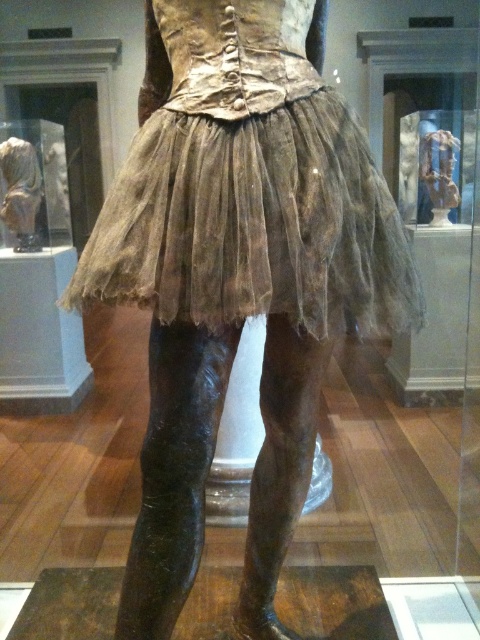
Question: Which point is farther from the camera taking this photo?

Choices:
 (A) (144, 232)
 (B) (24, 244)
 (C) (454, 186)

Answer: (B)

Question: Considering the relative positions of brown sheer tulle skirt at center and matte bronze statue at upper right in the image provided, where is brown sheer tulle skirt at center located with respect to matte bronze statue at upper right?

Choices:
 (A) above
 (B) below

Answer: (B)

Question: Which point is farther from the camera taking this photo?

Choices:
 (A) (435, 189)
 (B) (224, 216)
 (C) (33, 193)

Answer: (A)

Question: Is matte bronze statue at center below matte bronze statue at upper right?

Choices:
 (A) yes
 (B) no

Answer: (A)

Question: Does brown sheer tulle skirt at center have a lesser width compared to matte bronze statue at center?

Choices:
 (A) yes
 (B) no

Answer: (B)

Question: Which point is closer to the camera taking this photo?

Choices:
 (A) (351, 154)
 (B) (431, 205)
 (C) (11, 227)

Answer: (A)